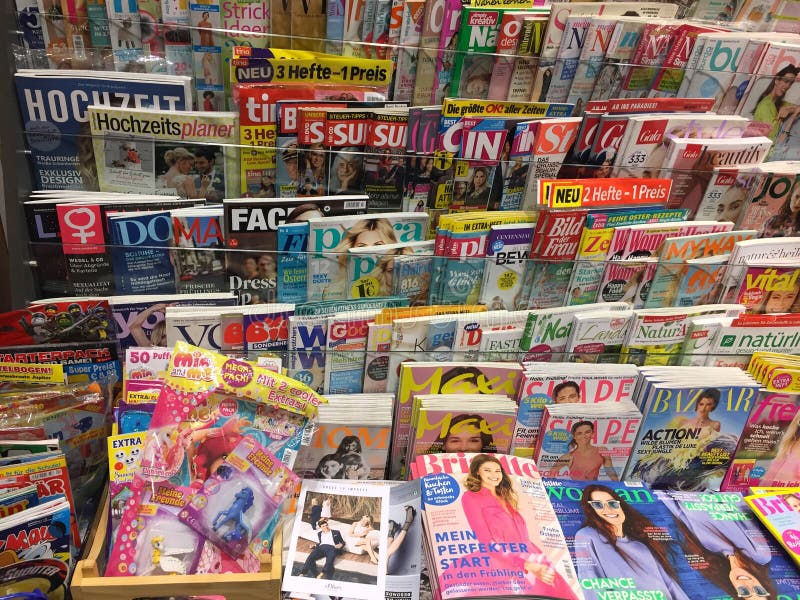
The height and width of the screenshot is (600, 800). I want to click on "woman" magazine, so click(628, 516), click(717, 541).